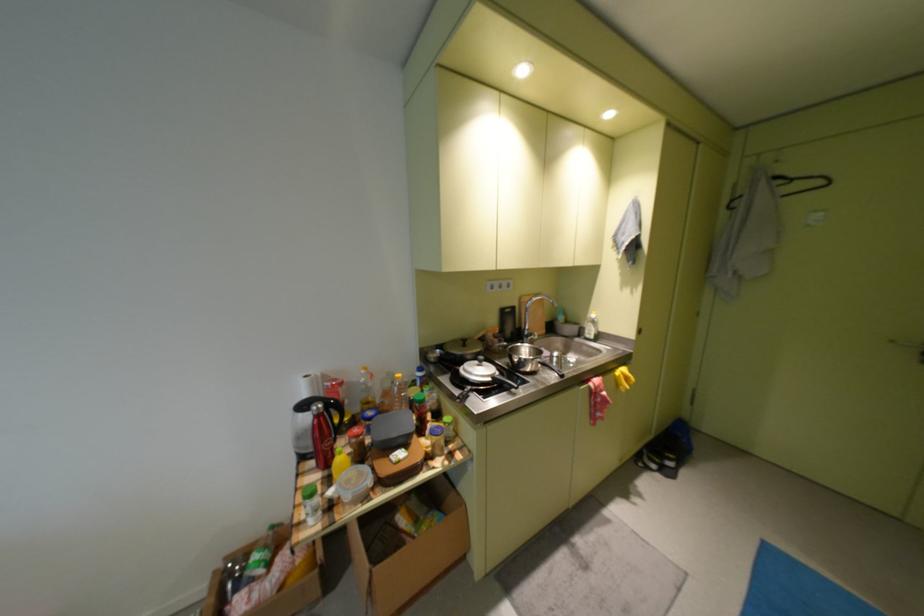
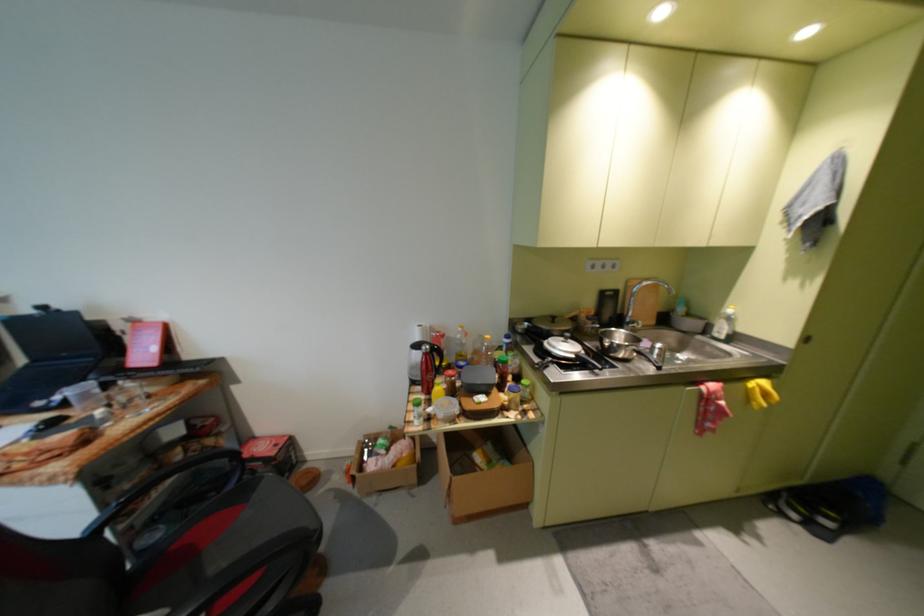
The point at (334, 479) is marked in the first image. Where is the corresponding point in the second image?

(435, 400)